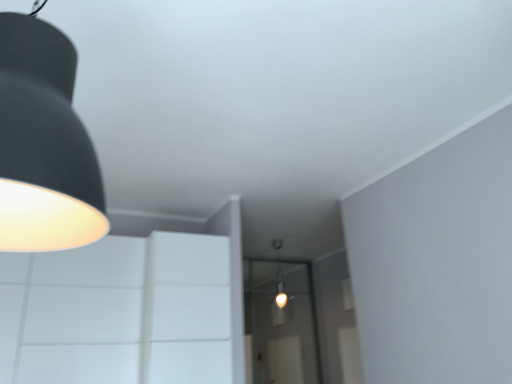
Question: From a real-world perspective, is transparent glass door at center positioned under matte black lampshade at upper left based on gravity?

Choices:
 (A) no
 (B) yes

Answer: (B)

Question: Does transparent glass door at center have a greater height compared to matte black lampshade at upper left?

Choices:
 (A) yes
 (B) no

Answer: (A)

Question: Is transparent glass door at center thinner than matte black lampshade at upper left?

Choices:
 (A) no
 (B) yes

Answer: (B)

Question: From the image's perspective, is transparent glass door at center over matte black lampshade at upper left?

Choices:
 (A) no
 (B) yes

Answer: (A)

Question: Is transparent glass door at center closer to the viewer compared to matte black lampshade at upper left?

Choices:
 (A) yes
 (B) no

Answer: (B)

Question: Would you say transparent glass door at center is outside matte black lampshade at upper left?

Choices:
 (A) no
 (B) yes

Answer: (B)

Question: From a real-world perspective, does matte black lampshade at upper left sit lower than transparent glass door at center?

Choices:
 (A) yes
 (B) no

Answer: (B)

Question: From the image's perspective, is matte black lampshade at upper left located above transparent glass door at center?

Choices:
 (A) no
 (B) yes

Answer: (B)

Question: Is matte black lampshade at upper left located outside transparent glass door at center?

Choices:
 (A) yes
 (B) no

Answer: (A)

Question: Can you confirm if matte black lampshade at upper left is wider than transparent glass door at center?

Choices:
 (A) yes
 (B) no

Answer: (A)

Question: Is matte black lampshade at upper left looking in the opposite direction of transparent glass door at center?

Choices:
 (A) no
 (B) yes

Answer: (A)

Question: Considering the relative sizes of matte black lampshade at upper left and transparent glass door at center in the image provided, is matte black lampshade at upper left bigger than transparent glass door at center?

Choices:
 (A) no
 (B) yes

Answer: (A)

Question: Considering the positions of transparent glass door at center and matte black lampshade at upper left in the image, is transparent glass door at center taller or shorter than matte black lampshade at upper left?

Choices:
 (A) short
 (B) tall

Answer: (B)